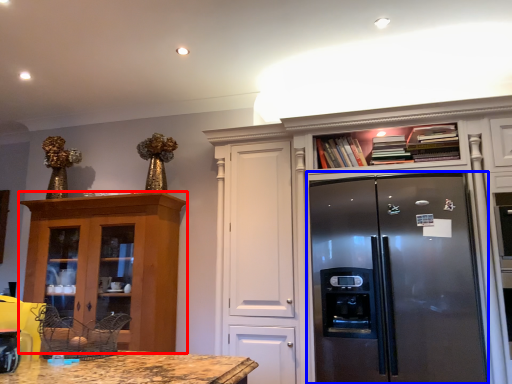
Question: Among these objects, which one is farthest to the camera, cabinetry (highlighted by a red box) or refrigerator (highlighted by a blue box)?

Choices:
 (A) cabinetry
 (B) refrigerator

Answer: (A)